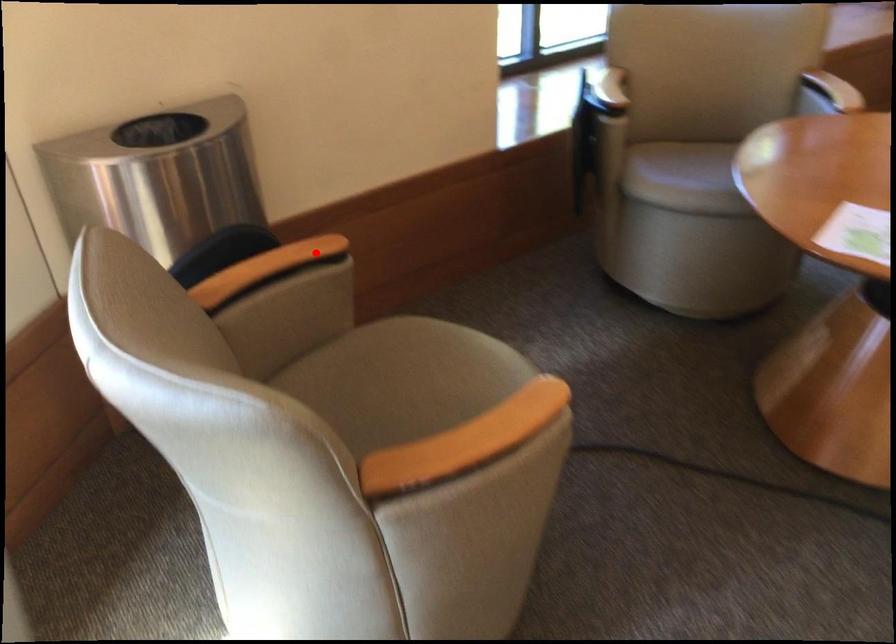
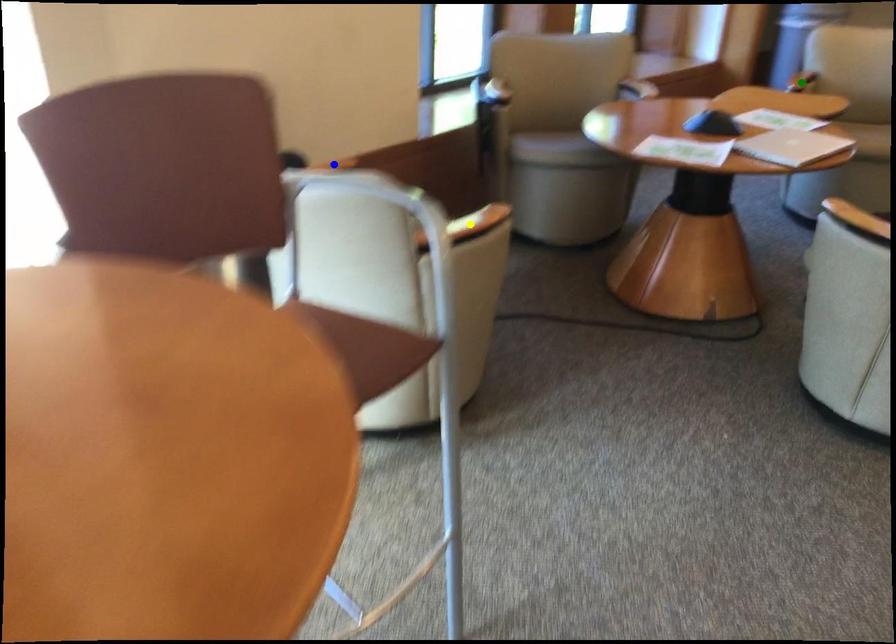
Question: I am providing you with two images of the same scene from different viewpoints. A red point is marked on the first image. You are given multiple points on the second image. In image 2, which mark is for the same physical point as the one in image 1?

Choices:
 (A) green point
 (B) blue point
 (C) yellow point

Answer: (B)